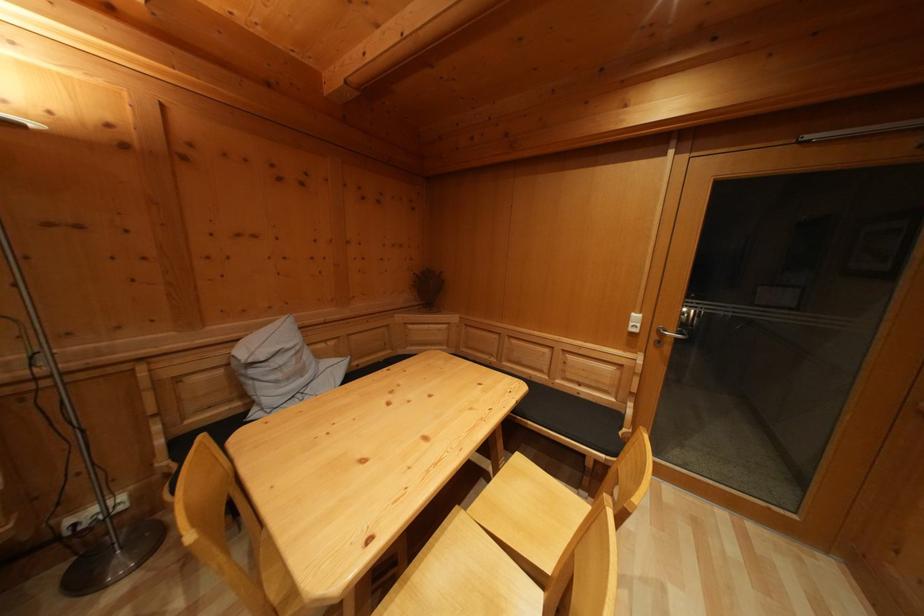
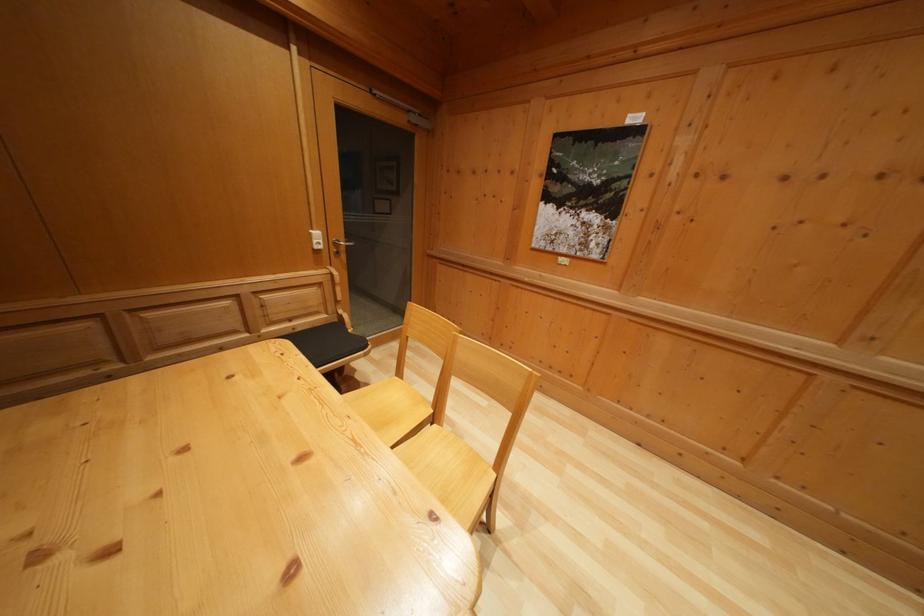
How did the camera likely rotate?

The rotation direction of the camera is right-down.